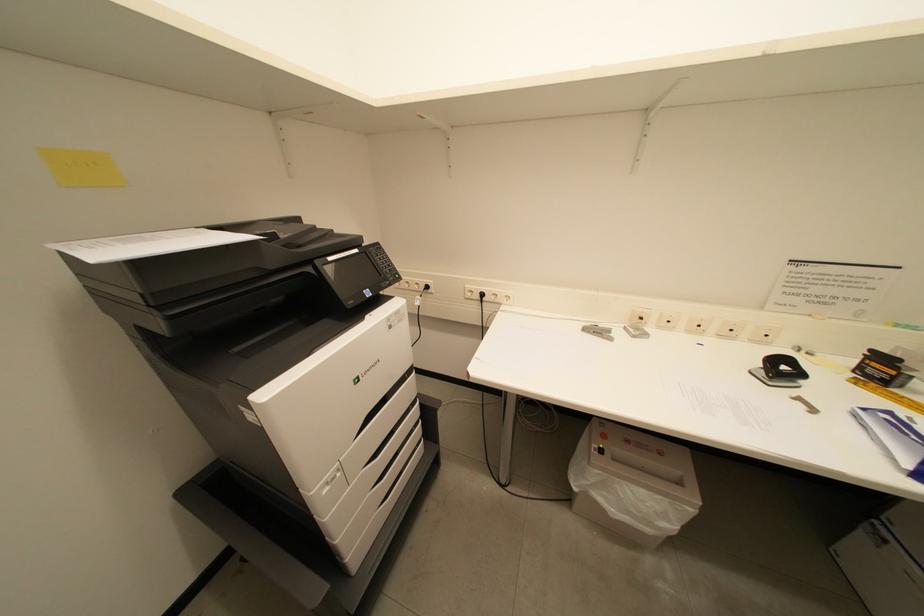
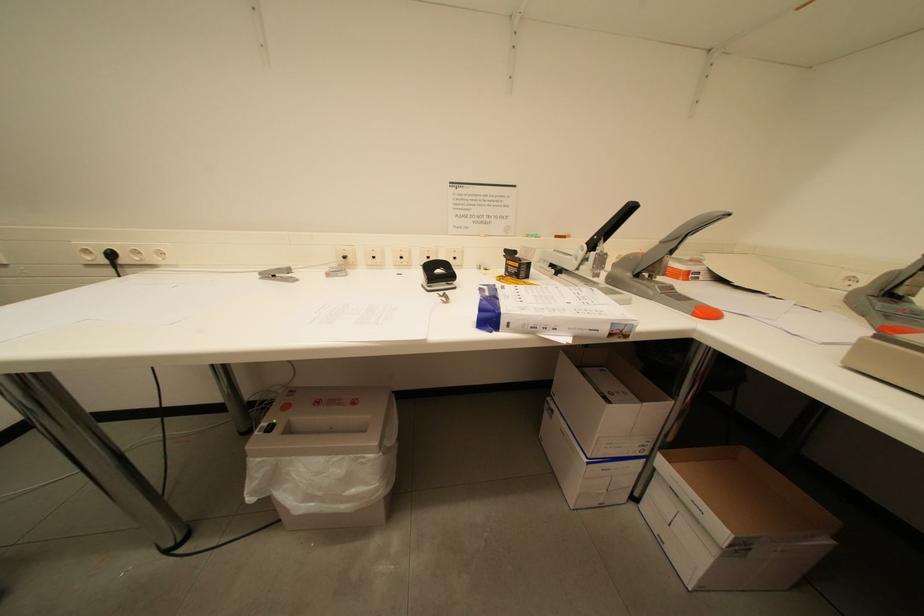
Question: The camera is either moving clockwise (left) or counter-clockwise (right) around the object. The first image is from the beginning of the video and the second image is from the end. Is the camera moving left or right when shooting the video?

Choices:
 (A) Left
 (B) Right

Answer: (A)